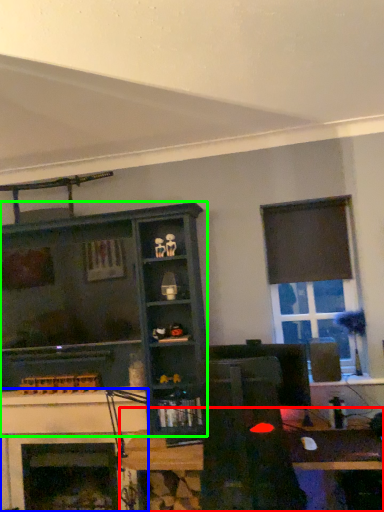
Question: Which is farther away from table (highlighted by a red box)? fireplace (highlighted by a blue box) or shelf (highlighted by a green box)?

Choices:
 (A) fireplace
 (B) shelf

Answer: (A)